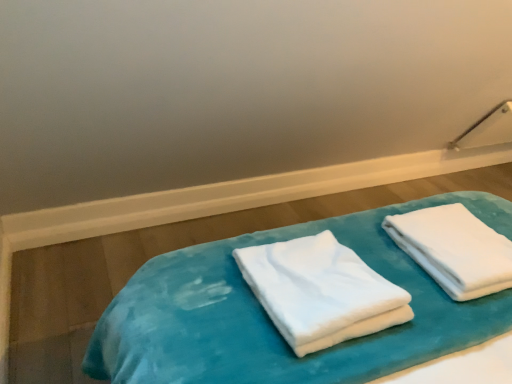
Question: From the image's perspective, is velvet blue bed at center over white soft towel at right, acting as the 1th towel starting from the right?

Choices:
 (A) no
 (B) yes

Answer: (A)

Question: Is white soft towel at right, acting as the 1th towel starting from the right, completely or partially inside velvet blue bed at center?

Choices:
 (A) no
 (B) yes

Answer: (A)

Question: Is velvet blue bed at center directly adjacent to white soft towel at right, placed as the 2th towel when sorted from left to right?

Choices:
 (A) no
 (B) yes

Answer: (A)

Question: From a real-world perspective, is velvet blue bed at center located higher than white soft towel at right, placed as the 2th towel when sorted from left to right?

Choices:
 (A) no
 (B) yes

Answer: (A)

Question: Does velvet blue bed at center have a greater width compared to white soft towel at right, placed as the 2th towel when sorted from left to right?

Choices:
 (A) yes
 (B) no

Answer: (A)

Question: Considering their positions, is velvet blue bed at center located in front of or behind white soft towel at center, which is the second towel in right-to-left order?

Choices:
 (A) behind
 (B) front

Answer: (A)

Question: From a real-world perspective, is velvet blue bed at center above or below white soft towel at center, the first towel when ordered from left to right?

Choices:
 (A) above
 (B) below

Answer: (B)

Question: Is point (168, 377) closer or farther from the camera than point (316, 266)?

Choices:
 (A) farther
 (B) closer

Answer: (B)

Question: Which is correct: velvet blue bed at center is inside white soft towel at center, which is the second towel in right-to-left order, or outside of it?

Choices:
 (A) outside
 (B) inside

Answer: (A)

Question: Does point (338, 311) appear closer or farther from the camera than point (256, 319)?

Choices:
 (A) closer
 (B) farther

Answer: (A)

Question: Looking at the image, does white soft towel at center, which is the second towel in right-to-left order, seem bigger or smaller compared to velvet blue bed at center?

Choices:
 (A) small
 (B) big

Answer: (A)

Question: From the image's perspective, is white soft towel at center, the first towel when ordered from left to right, positioned above or below velvet blue bed at center?

Choices:
 (A) above
 (B) below

Answer: (B)

Question: Is white soft towel at center, which is the second towel in right-to-left order, inside the boundaries of velvet blue bed at center, or outside?

Choices:
 (A) outside
 (B) inside

Answer: (A)

Question: Is white soft towel at center, which is the second towel in right-to-left order, to the left or to the right of white soft towel at right, acting as the 1th towel starting from the right, in the image?

Choices:
 (A) right
 (B) left

Answer: (B)

Question: Looking at the image, does white soft towel at center, which is the second towel in right-to-left order, seem bigger or smaller compared to white soft towel at right, placed as the 2th towel when sorted from left to right?

Choices:
 (A) small
 (B) big

Answer: (B)